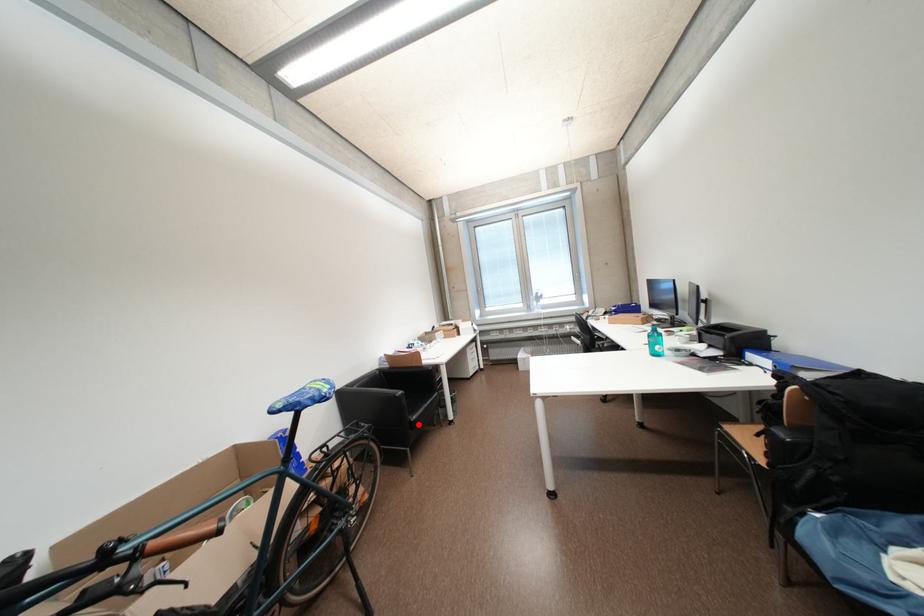
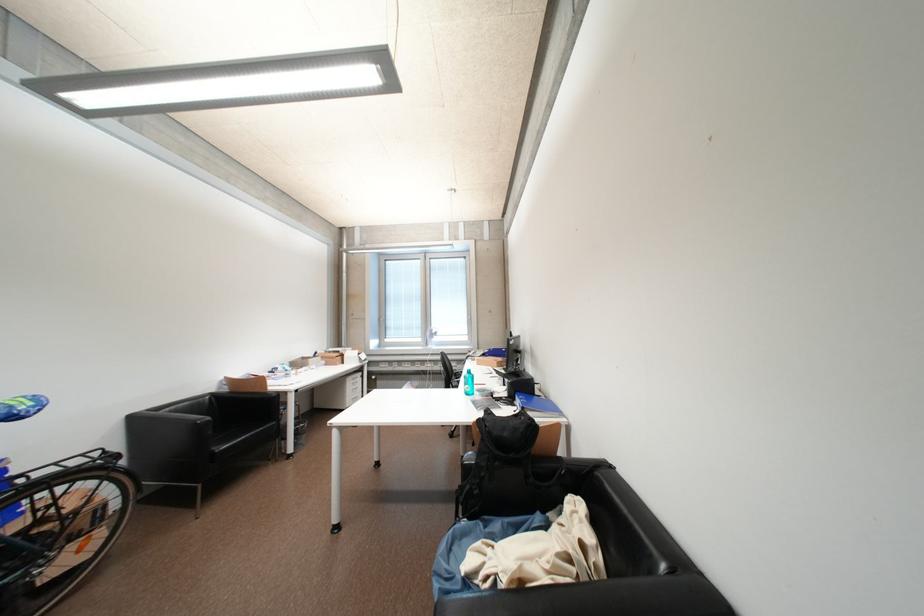
Question: I am providing you with two images of the same scene from different viewpoints. A red point is marked on the first image. At the location where the point appears in image 1, is it still visible in image 2?

Choices:
 (A) Yes
 (B) No

Answer: (A)